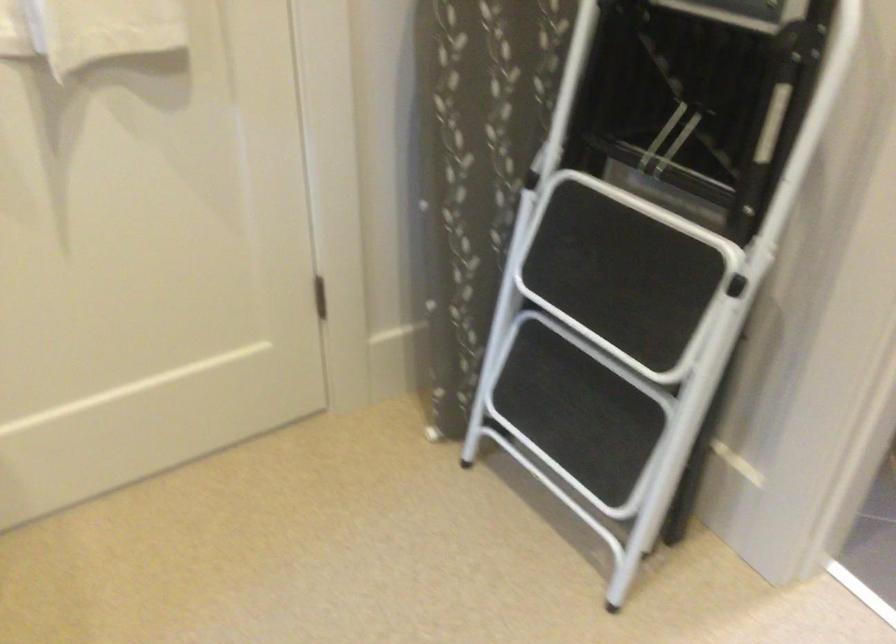
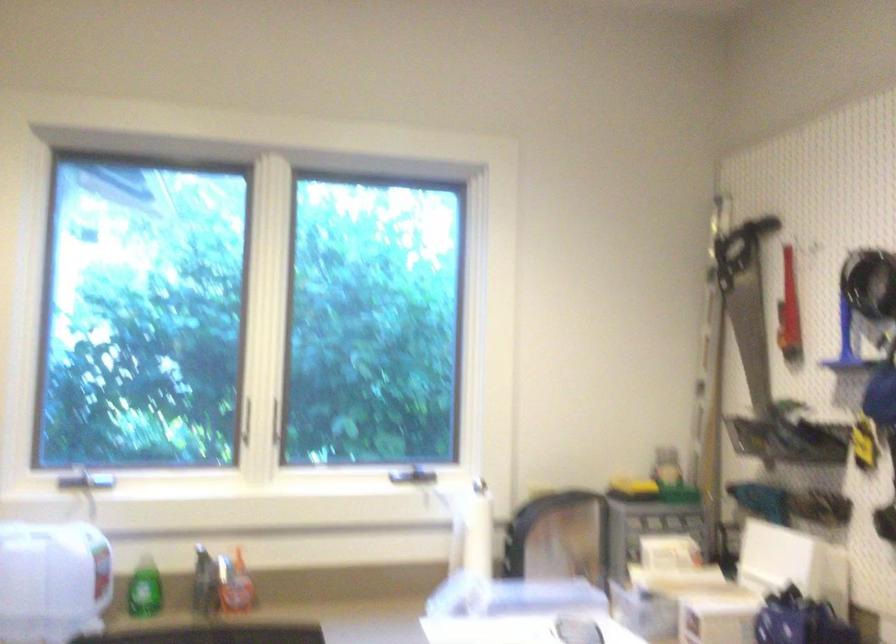
Question: The images are taken continuously from a first-person perspective. In which direction is your viewpoint rotating?

Choices:
 (A) Left
 (B) Right
 (C) Up
 (D) Down

Answer: (A)